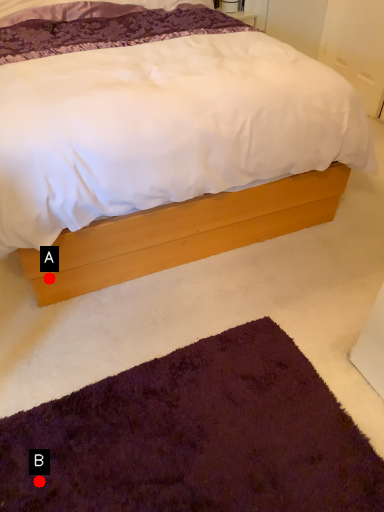
Question: Two points are circled on the image, labeled by A and B beside each circle. Which point appears farthest from the camera in this image?

Choices:
 (A) A is further
 (B) B is further

Answer: (A)